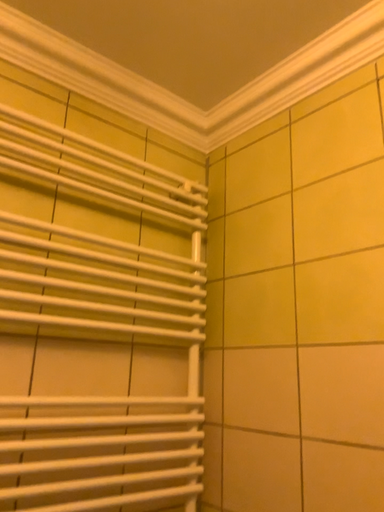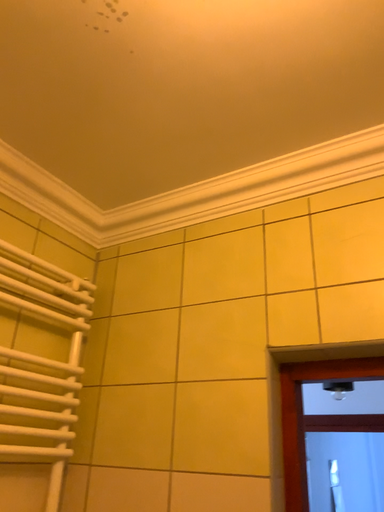
Question: How did the camera likely rotate when shooting the video?

Choices:
 (A) rotated right
 (B) rotated left

Answer: (A)